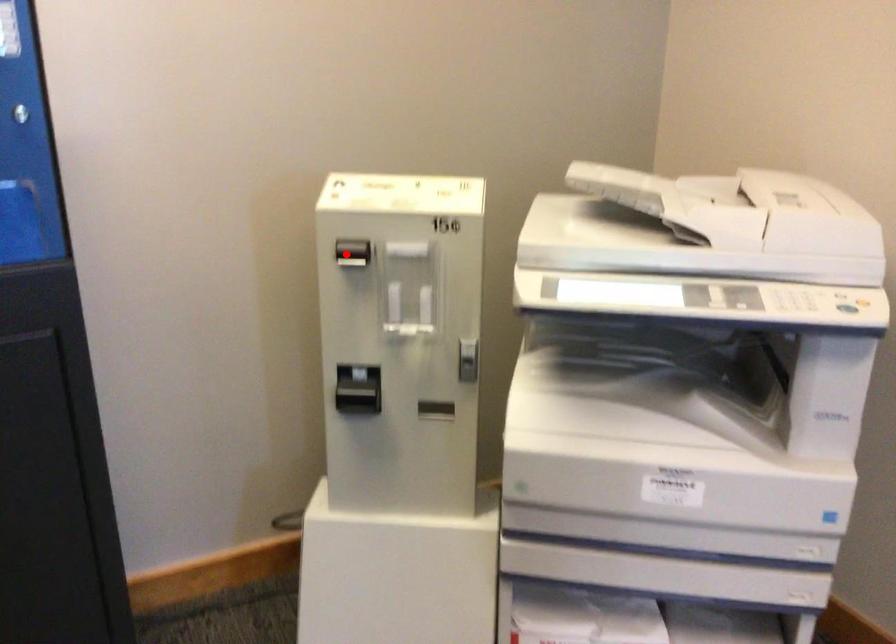
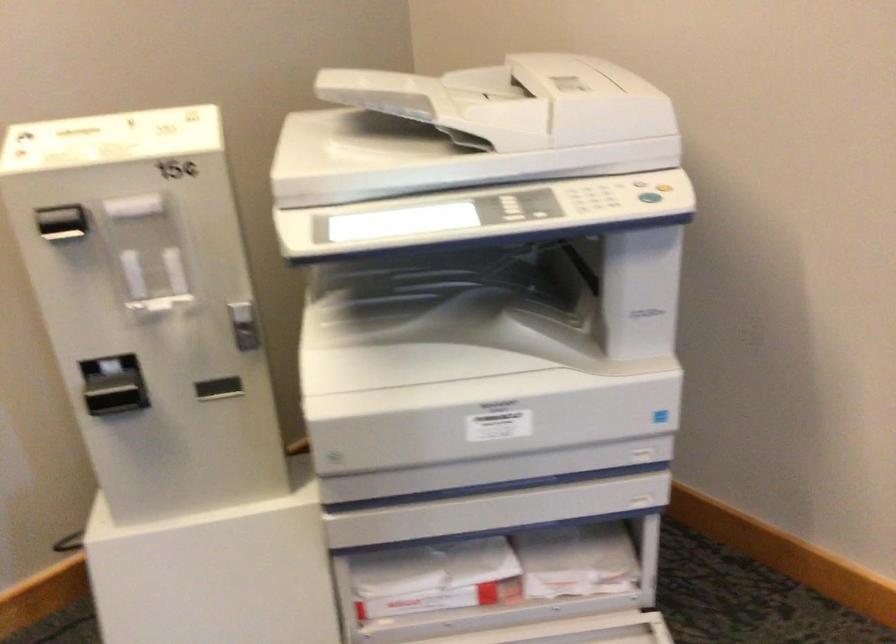
Question: I am providing you with two images of the same scene from different viewpoints. Given a red point in image1, look at the same physical point in image2. Is it:

Choices:
 (A) Closer to the viewpoint
 (B) Farther from the viewpoint

Answer: (A)